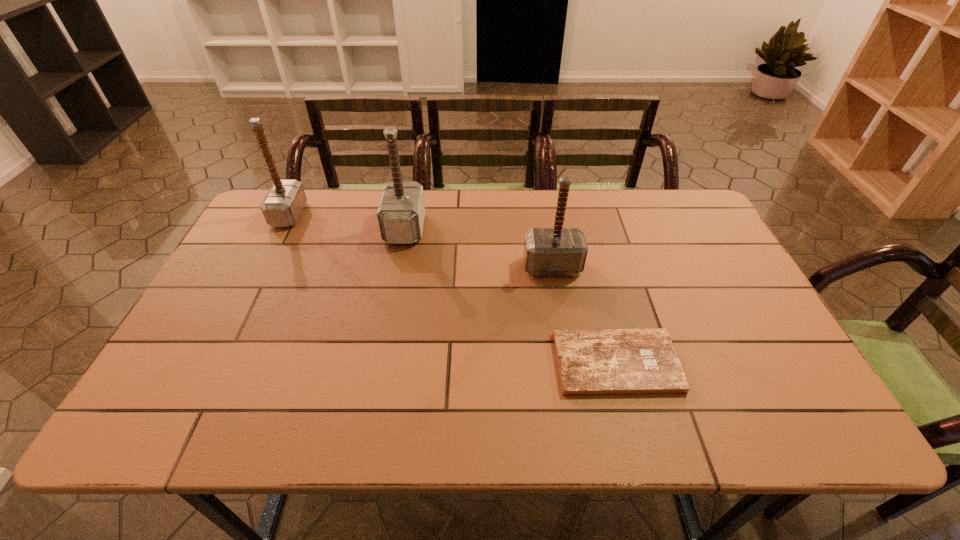
Identify the location of free area in between the rightmost hammer and the Bible. click(583, 315).

Find the location of a particular element. The image size is (960, 540). free area in between the rightmost hammer and the third object from right to left is located at coordinates (479, 248).

This screenshot has width=960, height=540. I want to click on free spot between the second object from left to right and the nearest object, so click(x=510, y=296).

Where is `free area in between the second nearest object and the third object from right to left`? This screenshot has width=960, height=540. free area in between the second nearest object and the third object from right to left is located at coordinates (479, 248).

Where is `free space between the second nearest object and the second hammer from left to right`? The width and height of the screenshot is (960, 540). free space between the second nearest object and the second hammer from left to right is located at coordinates (479, 248).

Image resolution: width=960 pixels, height=540 pixels. In order to click on unoccupied position between the second hammer from left to right and the shortest object in this screenshot , I will do `click(510, 296)`.

Locate an element on the screen. Image resolution: width=960 pixels, height=540 pixels. vacant space in between the rightmost hammer and the Bible is located at coordinates point(583,315).

Image resolution: width=960 pixels, height=540 pixels. In order to click on object that can be found as the second closest to the leftmost object in this screenshot , I will do pos(557,251).

Point out which object is positioned as the third nearest to the shortest object. Please provide its 2D coordinates. Your answer should be formatted as a tuple, i.e. [(x, y)], where the tuple contains the x and y coordinates of a point satisfying the conditions above.

[(282, 206)]

In order to click on hammer object that ranks as the closest to the leftmost object in this screenshot , I will do `click(401, 212)`.